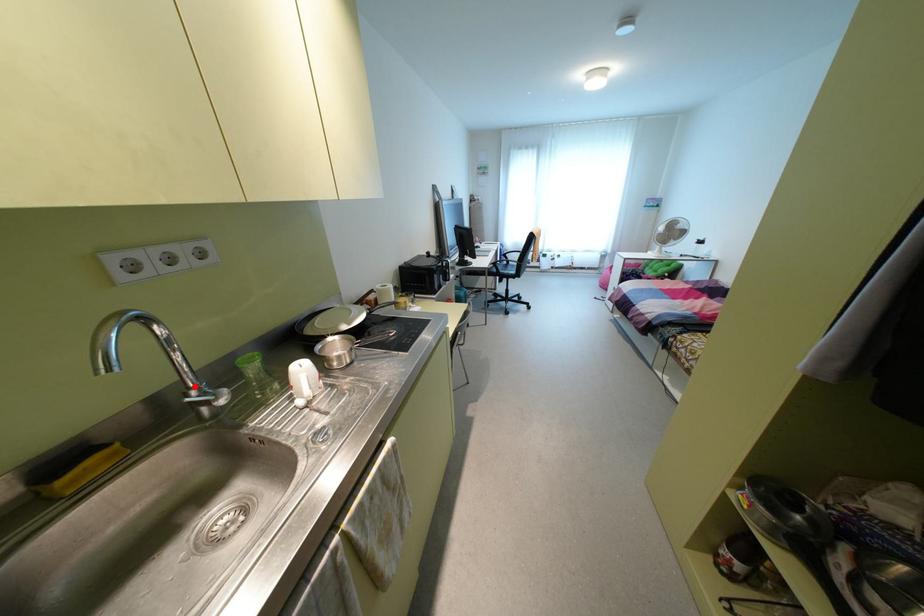
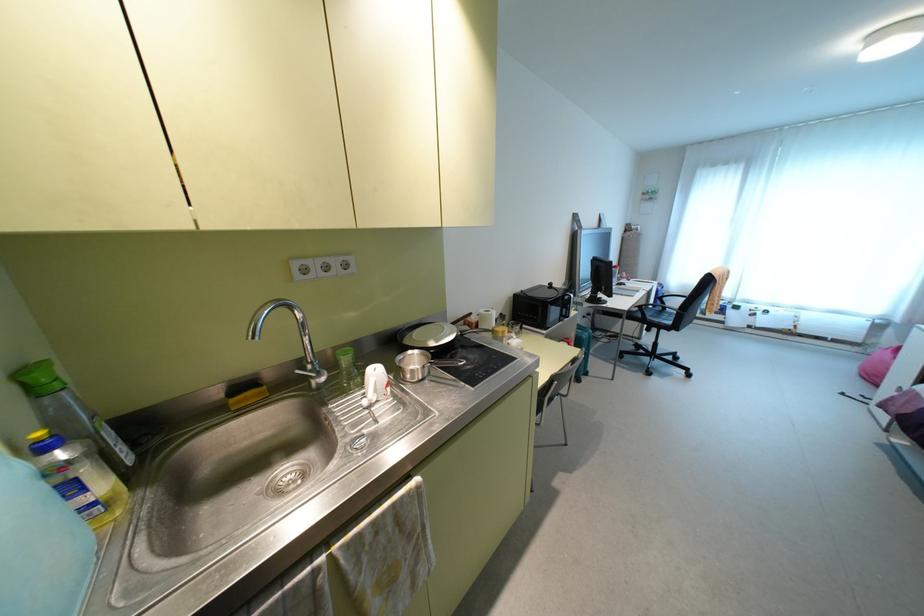
Where in the second image is the point corresponding to the highlighted location from the first image?

(310, 362)